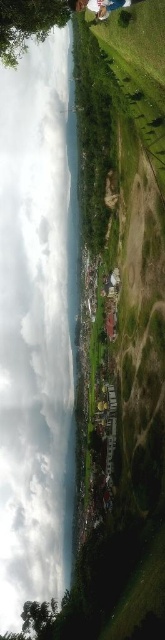
In the scene shown: You are a hiker planning to cross the transparent water at center and need to avoid the green leafy tree at lower left. Can you walk around the tree without getting wet?

The transparent water at center is taller than green leafy tree at lower left, so the tree is shorter than the water. Therefore, you cannot walk around the tree without getting wet because the water is taller than the tree, implying it might be a stream or pond covering the area around the tree.